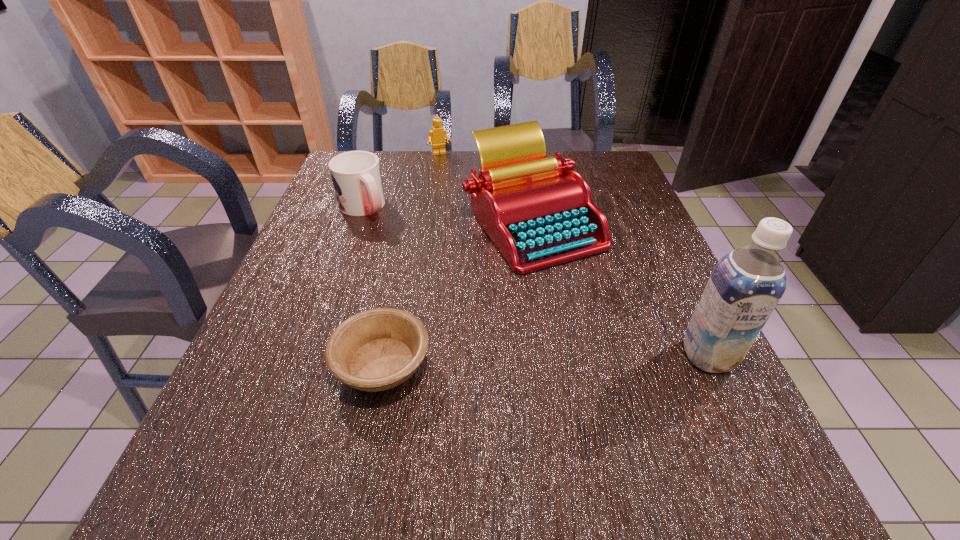
You are a GUI agent. You are given a task and a screenshot of the screen. Output one action in this format:
    pyautogui.click(x=<x>, y=<y>)
    Task: Click on the free space located 0.280m on the face of the farthest object
    The image size is (960, 540).
    Given the screenshot: What is the action you would take?
    pyautogui.click(x=465, y=203)

The image size is (960, 540). I want to click on vacant space located 0.220m on the face of the farthest object, so click(x=459, y=192).

I want to click on vacant region located on the typing side of the second tallest object, so click(x=529, y=340).

Where is `vacant area situated 0.130m on the typing side of the second tallest object`? The width and height of the screenshot is (960, 540). vacant area situated 0.130m on the typing side of the second tallest object is located at coordinates (530, 318).

Locate an element on the screen. The height and width of the screenshot is (540, 960). vacant position located on the typing side of the second tallest object is located at coordinates (529, 340).

You are a GUI agent. You are given a task and a screenshot of the screen. Output one action in this format:
    pyautogui.click(x=<x>, y=<y>)
    Task: Click on the vacant space located 0.360m on the side of the mug with the handle
    This screenshot has width=960, height=540.
    Given the screenshot: What is the action you would take?
    pyautogui.click(x=444, y=300)

Where is `vacant space situated on the side of the mug with the handle`? This screenshot has height=540, width=960. vacant space situated on the side of the mug with the handle is located at coordinates (397, 248).

Where is `free location located on the side of the mug with the handle`? Image resolution: width=960 pixels, height=540 pixels. free location located on the side of the mug with the handle is located at coordinates (394, 244).

Where is `Lego present at the far edge`? Image resolution: width=960 pixels, height=540 pixels. Lego present at the far edge is located at coordinates (437, 135).

At what (x,y) coordinates should I click in order to perform the action: click on typewriter that is at the far edge. Please return your answer as a coordinate pair (x, y). The width and height of the screenshot is (960, 540). Looking at the image, I should click on (538, 212).